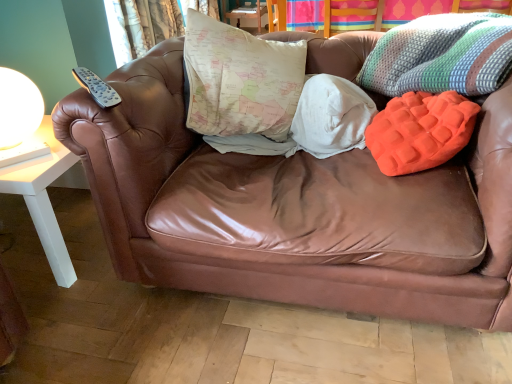
In order to face white glossy table lamp at left, should I rotate leftwards or rightwards?

To face it directly, rotate left by 30.902 degrees.

The height and width of the screenshot is (384, 512). What are the coordinates of `knitted multicolored throw pillow at upper right` in the screenshot? It's located at (441, 55).

This screenshot has width=512, height=384. I want to click on white glossy table lamp at left, so click(x=19, y=118).

Is textured fabric curtain at upper left wider than orange textured pillow at right, the first pillow viewed from the right?

No, textured fabric curtain at upper left is not wider than orange textured pillow at right, the first pillow viewed from the right.

From the image's perspective, is textured fabric curtain at upper left on orange textured pillow at right, acting as the second pillow starting from the left?

Yes, from the image's perspective, textured fabric curtain at upper left is above orange textured pillow at right, acting as the second pillow starting from the left.

From a real-world perspective, is textured fabric curtain at upper left located beneath orange textured pillow at right, the first pillow viewed from the right?

Correct, in the physical world, textured fabric curtain at upper left is lower than orange textured pillow at right, the first pillow viewed from the right.

Is orange textured pillow at right, acting as the second pillow starting from the left, not within white glossy table lamp at left?

Yes, orange textured pillow at right, acting as the second pillow starting from the left, is outside of white glossy table lamp at left.

Is orange textured pillow at right, the first pillow viewed from the right, not near white glossy table lamp at left?

Yes.

From their relative heights in the image, would you say orange textured pillow at right, the first pillow viewed from the right, is taller or shorter than white glossy table lamp at left?

In the image, orange textured pillow at right, the first pillow viewed from the right, appears to be shorter than white glossy table lamp at left.

From the image's perspective, is textured fabric curtain at upper left located above or below knitted multicolored throw pillow at upper right?

textured fabric curtain at upper left is situated higher than knitted multicolored throw pillow at upper right in the image.

Considering the relative sizes of textured fabric curtain at upper left and knitted multicolored throw pillow at upper right in the image provided, is textured fabric curtain at upper left smaller than knitted multicolored throw pillow at upper right?

Yes, textured fabric curtain at upper left is smaller than knitted multicolored throw pillow at upper right.

Which is behind, textured fabric curtain at upper left or knitted multicolored throw pillow at upper right?

textured fabric curtain at upper left is behind.

Is knitted multicolored throw pillow at upper right smaller than map-patterned fabric pillow at center, which ranks as the 1th pillow in left-to-right order?

Indeed, knitted multicolored throw pillow at upper right has a smaller size compared to map-patterned fabric pillow at center, which ranks as the 1th pillow in left-to-right order.

What's the angular difference between knitted multicolored throw pillow at upper right and map-patterned fabric pillow at center, the second pillow when ordered from right to left,'s facing directions?

There is a 0.000669-degree angle between the facing directions of knitted multicolored throw pillow at upper right and map-patterned fabric pillow at center, the second pillow when ordered from right to left.

From the image's perspective, does knitted multicolored throw pillow at upper right appear lower than map-patterned fabric pillow at center, which ranks as the 1th pillow in left-to-right order?

Incorrect, from the image's perspective, knitted multicolored throw pillow at upper right is higher than map-patterned fabric pillow at center, which ranks as the 1th pillow in left-to-right order.

In terms of width, does knitted multicolored throw pillow at upper right look wider or thinner when compared to map-patterned fabric pillow at center, the second pillow when ordered from right to left?

Clearly, knitted multicolored throw pillow at upper right has more width compared to map-patterned fabric pillow at center, the second pillow when ordered from right to left.

Based on the photo, from the image's perspective, which is below, knitted multicolored throw pillow at upper right or textured fabric curtain at upper left?

knitted multicolored throw pillow at upper right.

Looking at this image, in the image, is knitted multicolored throw pillow at upper right on the left side or the right side of textured fabric curtain at upper left?

knitted multicolored throw pillow at upper right is to the right of textured fabric curtain at upper left.

Looking at this image, between knitted multicolored throw pillow at upper right and textured fabric curtain at upper left, which one has more height?

textured fabric curtain at upper left is taller.

From a real-world perspective, between knitted multicolored throw pillow at upper right and textured fabric curtain at upper left, who is vertically higher?

From a 3D spatial view, knitted multicolored throw pillow at upper right is above.

From the image's perspective, which is below, map-patterned fabric pillow at center, the second pillow when ordered from right to left, or orange textured pillow at right, acting as the second pillow starting from the left?

orange textured pillow at right, acting as the second pillow starting from the left, appears lower in the image.

Considering their positions, is map-patterned fabric pillow at center, which ranks as the 1th pillow in left-to-right order, located in front of or behind orange textured pillow at right, the first pillow viewed from the right?

Visually, map-patterned fabric pillow at center, which ranks as the 1th pillow in left-to-right order, is located behind orange textured pillow at right, the first pillow viewed from the right.

Is point (290, 71) farther from camera compared to point (404, 131)?

That is True.

From the picture: Which is correct: map-patterned fabric pillow at center, which ranks as the 1th pillow in left-to-right order, is inside orange textured pillow at right, acting as the second pillow starting from the left, or outside of it?

map-patterned fabric pillow at center, which ranks as the 1th pillow in left-to-right order, is located beyond the bounds of orange textured pillow at right, acting as the second pillow starting from the left.

Is knitted multicolored throw pillow at upper right placed right next to orange textured pillow at right, acting as the second pillow starting from the left?

There is a gap between knitted multicolored throw pillow at upper right and orange textured pillow at right, acting as the second pillow starting from the left.

Is knitted multicolored throw pillow at upper right facing away from orange textured pillow at right, acting as the second pillow starting from the left?

No, knitted multicolored throw pillow at upper right is not facing the opposite direction of orange textured pillow at right, acting as the second pillow starting from the left.

Which object is positioned more to the left, knitted multicolored throw pillow at upper right or orange textured pillow at right, acting as the second pillow starting from the left?

From the viewer's perspective, orange textured pillow at right, acting as the second pillow starting from the left, appears more on the left side.

From the image's perspective, is knitted multicolored throw pillow at upper right above or below orange textured pillow at right, acting as the second pillow starting from the left?

knitted multicolored throw pillow at upper right is situated higher than orange textured pillow at right, acting as the second pillow starting from the left, in the image.

Where is `curtain that is behind the orange textured pillow at right, acting as the second pillow starting from the left`? The height and width of the screenshot is (384, 512). curtain that is behind the orange textured pillow at right, acting as the second pillow starting from the left is located at coordinates (148, 23).

Find the location of `pillow below the white glossy table lamp at left (from the image's perspective)`. pillow below the white glossy table lamp at left (from the image's perspective) is located at coordinates (420, 131).

Which object lies nearer to the anchor point orange textured pillow at right, acting as the second pillow starting from the left, knitted multicolored throw pillow at upper right or white glossy table lamp at left?

knitted multicolored throw pillow at upper right is positioned closer to the anchor orange textured pillow at right, acting as the second pillow starting from the left.

Based on their spatial positions, is white glossy table lamp at left or map-patterned fabric pillow at center, which ranks as the 1th pillow in left-to-right order, closer to textured fabric curtain at upper left?

The object closer to textured fabric curtain at upper left is map-patterned fabric pillow at center, which ranks as the 1th pillow in left-to-right order.

Which object lies nearer to the anchor point map-patterned fabric pillow at center, the second pillow when ordered from right to left, orange textured pillow at right, acting as the second pillow starting from the left, or white glossy table lamp at left?

orange textured pillow at right, acting as the second pillow starting from the left, is positioned closer to the anchor map-patterned fabric pillow at center, the second pillow when ordered from right to left.

Looking at the image, which one is located further to knitted multicolored throw pillow at upper right, textured fabric curtain at upper left or map-patterned fabric pillow at center, which ranks as the 1th pillow in left-to-right order?

textured fabric curtain at upper left lies further to knitted multicolored throw pillow at upper right than the other object.

Which object lies further to the anchor point map-patterned fabric pillow at center, which ranks as the 1th pillow in left-to-right order, white glossy table lamp at left or orange textured pillow at right, acting as the second pillow starting from the left?

white glossy table lamp at left is positioned further to the anchor map-patterned fabric pillow at center, which ranks as the 1th pillow in left-to-right order.

Which object lies further to the anchor point orange textured pillow at right, acting as the second pillow starting from the left, knitted multicolored throw pillow at upper right or textured fabric curtain at upper left?

textured fabric curtain at upper left is positioned further to the anchor orange textured pillow at right, acting as the second pillow starting from the left.

Which object lies further to the anchor point map-patterned fabric pillow at center, the second pillow when ordered from right to left, textured fabric curtain at upper left or knitted multicolored throw pillow at upper right?

textured fabric curtain at upper left is further to map-patterned fabric pillow at center, the second pillow when ordered from right to left.

Considering their positions, is orange textured pillow at right, acting as the second pillow starting from the left, positioned closer to textured fabric curtain at upper left than white glossy table lamp at left?

white glossy table lamp at left.

In order to click on table lamp between knitted multicolored throw pillow at upper right and textured fabric curtain at upper left along the z-axis in this screenshot , I will do `click(19, 118)`.

Where is `pillow between white glossy table lamp at left and orange textured pillow at right, the first pillow viewed from the right`? The image size is (512, 384). pillow between white glossy table lamp at left and orange textured pillow at right, the first pillow viewed from the right is located at coordinates (240, 80).

I want to click on pillow between orange textured pillow at right, the first pillow viewed from the right, and textured fabric curtain at upper left in the front-back direction, so (240, 80).

This screenshot has height=384, width=512. Find the location of `pillow between map-patterned fabric pillow at center, which ranks as the 1th pillow in left-to-right order, and knitted multicolored throw pillow at upper right, in the horizontal direction`. pillow between map-patterned fabric pillow at center, which ranks as the 1th pillow in left-to-right order, and knitted multicolored throw pillow at upper right, in the horizontal direction is located at coordinates (420, 131).